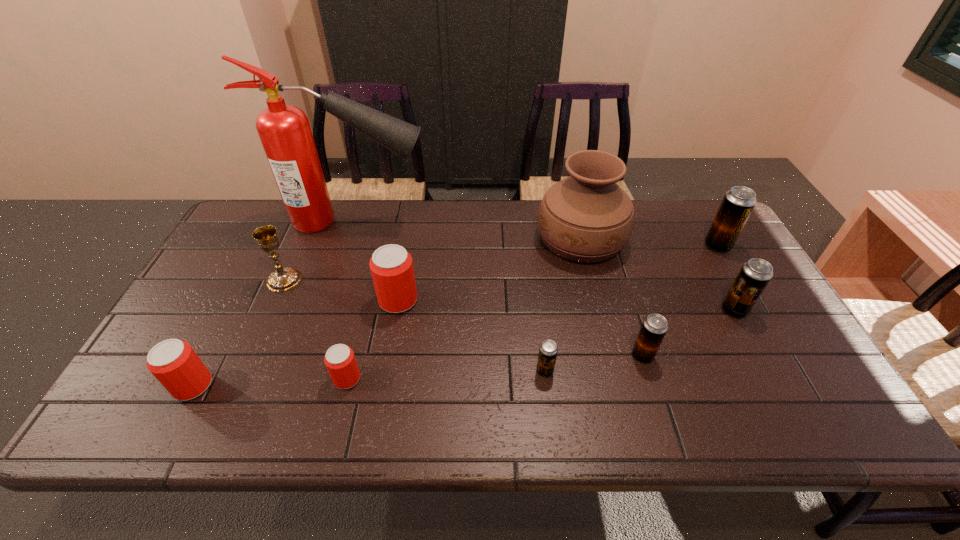
The width and height of the screenshot is (960, 540). In order to click on free space located 0.180m on the back of the chalice in this screenshot , I will do (x=306, y=230).

I want to click on free space located on the left of the rightmost red beer can, so click(299, 300).

You are a GUI agent. You are given a task and a screenshot of the screen. Output one action in this format:
    pyautogui.click(x=<x>, y=<y>)
    Task: Click on the free region located on the back of the third nearest black beer can
    
    Given the screenshot: What is the action you would take?
    pyautogui.click(x=718, y=280)

In order to click on free space located on the right of the leftmost beer can in this screenshot , I will do `click(268, 386)`.

Find the location of a particular element. Image resolution: width=960 pixels, height=540 pixels. free space located 0.210m on the left of the third black beer can from right to left is located at coordinates (545, 355).

Image resolution: width=960 pixels, height=540 pixels. Find the location of `blank area located 0.060m on the back of the smallest red beer can`. blank area located 0.060m on the back of the smallest red beer can is located at coordinates (355, 346).

The image size is (960, 540). I want to click on vacant space located on the front of the leftmost black beer can, so click(552, 431).

At what (x,y) coordinates should I click in order to perform the action: click on fire extinguisher located at the far edge. Please return your answer as a coordinate pair (x, y). The height and width of the screenshot is (540, 960). Looking at the image, I should click on (284, 130).

The image size is (960, 540). Identify the location of urn that is at the far edge. (586, 217).

Where is `beer can that is at the far edge`? Image resolution: width=960 pixels, height=540 pixels. beer can that is at the far edge is located at coordinates (738, 203).